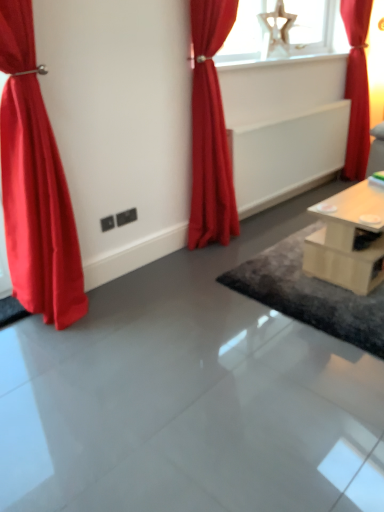
Identify the location of free space to the right of matte red curtain at left, which ranks as the third curtain in right-to-left order. This screenshot has height=512, width=384. (130, 317).